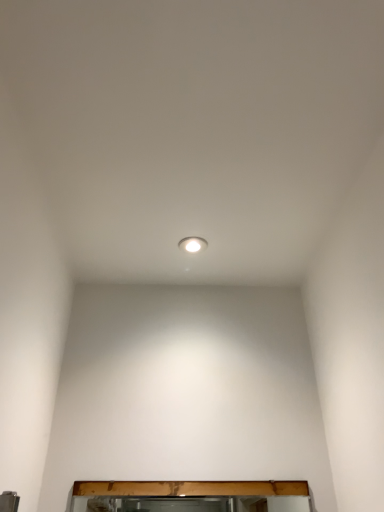
Where is `white glossy light fixture at center`? white glossy light fixture at center is located at coordinates (192, 244).

Describe the element at coordinates (192, 244) in the screenshot. I see `white glossy light fixture at center` at that location.

Locate an element on the screen. white glossy light fixture at center is located at coordinates (192, 244).